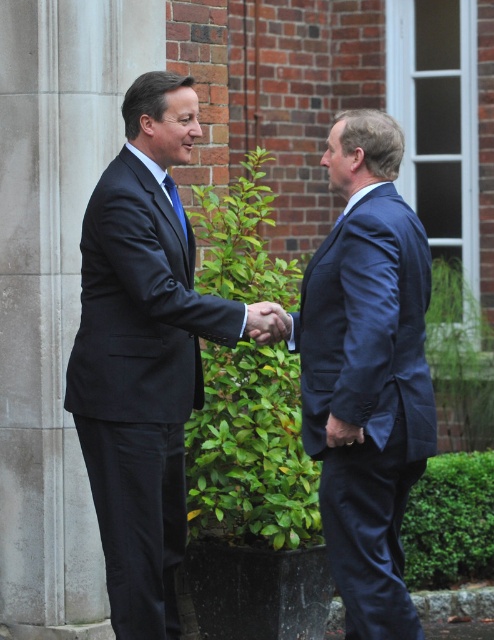
You are standing at the point with coordinates point (181,225) and want to walk towards the point with coordinates point (114,275). Which direction should you move?

You should move forward because point (114,275) is in front of point (181,225).

You are standing in front of the brick wall and want to place a small decoration on the wall. You have two points marked on the wall where you can place it. The points are labeled as point (413, 456) and point (173, 205). Which point is closer to you where you should place the decoration?

Point (413, 456) is closer to the viewer than point (173, 205), so you should place the decoration on point (413, 456).

You are a photographer adjusting your camera settings to capture the two men shaking hands. You need to ensure both the matte black suit at center and the blue silk tie at center are clearly visible. Considering their sizes, which object should you focus on first to ensure proper exposure?

The matte black suit at center is taller than the blue silk tie at center, so focusing on the matte black suit at center first will help ensure proper exposure since it occupies more space in the frame.